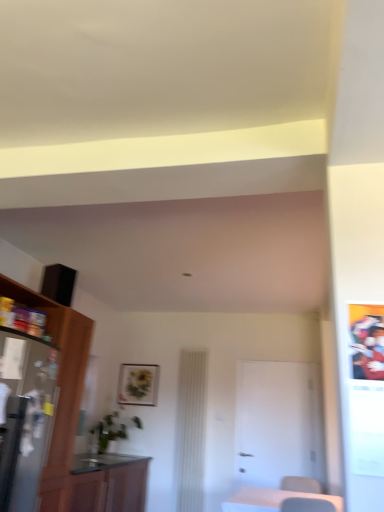
Question: From a real-world perspective, is white matte door at center positioned over wooden cabinet at left, placed as the 2th cabinetry when sorted from bottom to top, based on gravity?

Choices:
 (A) no
 (B) yes

Answer: (A)

Question: Considering the relative positions of white matte door at center and wooden cabinet at left, marked as the 1th cabinetry in a top-to-bottom arrangement, in the image provided, is white matte door at center in front of wooden cabinet at left, marked as the 1th cabinetry in a top-to-bottom arrangement,?

Choices:
 (A) no
 (B) yes

Answer: (A)

Question: Can you confirm if white matte door at center is taller than wooden cabinet at left, marked as the 1th cabinetry in a top-to-bottom arrangement?

Choices:
 (A) yes
 (B) no

Answer: (B)

Question: Would you say wooden cabinet at left, marked as the 1th cabinetry in a top-to-bottom arrangement, is part of white matte door at center's contents?

Choices:
 (A) yes
 (B) no

Answer: (B)

Question: From a real-world perspective, does white matte door at center sit lower than wooden cabinet at left, placed as the 2th cabinetry when sorted from bottom to top?

Choices:
 (A) yes
 (B) no

Answer: (A)

Question: From the image's perspective, is white matte door at center under wooden cabinet at left, placed as the 2th cabinetry when sorted from bottom to top?

Choices:
 (A) no
 (B) yes

Answer: (B)

Question: Is wooden table at lower right outside of wooden cabinet at left, marked as the 1th cabinetry in a top-to-bottom arrangement?

Choices:
 (A) yes
 (B) no

Answer: (A)

Question: Is wooden cabinet at left, marked as the 1th cabinetry in a top-to-bottom arrangement, surrounded by wooden table at lower right?

Choices:
 (A) yes
 (B) no

Answer: (B)

Question: Can you confirm if wooden table at lower right is thinner than wooden cabinet at left, placed as the 2th cabinetry when sorted from bottom to top?

Choices:
 (A) yes
 (B) no

Answer: (B)

Question: Does wooden table at lower right turn towards wooden cabinet at left, marked as the 1th cabinetry in a top-to-bottom arrangement?

Choices:
 (A) yes
 (B) no

Answer: (B)

Question: Can you see wooden table at lower right touching wooden cabinet at left, placed as the 2th cabinetry when sorted from bottom to top?

Choices:
 (A) yes
 (B) no

Answer: (B)

Question: Is there a large distance between wooden table at lower right and wooden cabinet at left, marked as the 1th cabinetry in a top-to-bottom arrangement?

Choices:
 (A) no
 (B) yes

Answer: (B)

Question: Could you tell me if wooden table at lower right is turned towards metallic silver refrigerator at left?

Choices:
 (A) no
 (B) yes

Answer: (A)